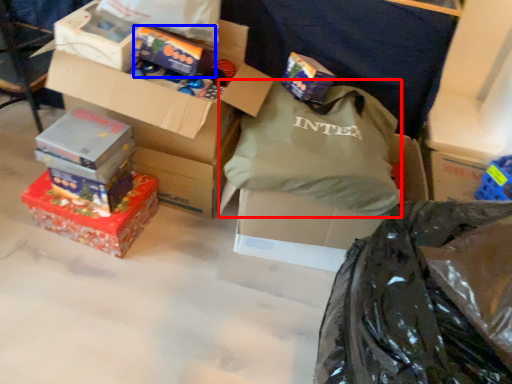
Question: Which point is closer to the camera, grocery bag (highlighted by a red box) or box (highlighted by a blue box)?

Choices:
 (A) grocery bag
 (B) box

Answer: (A)